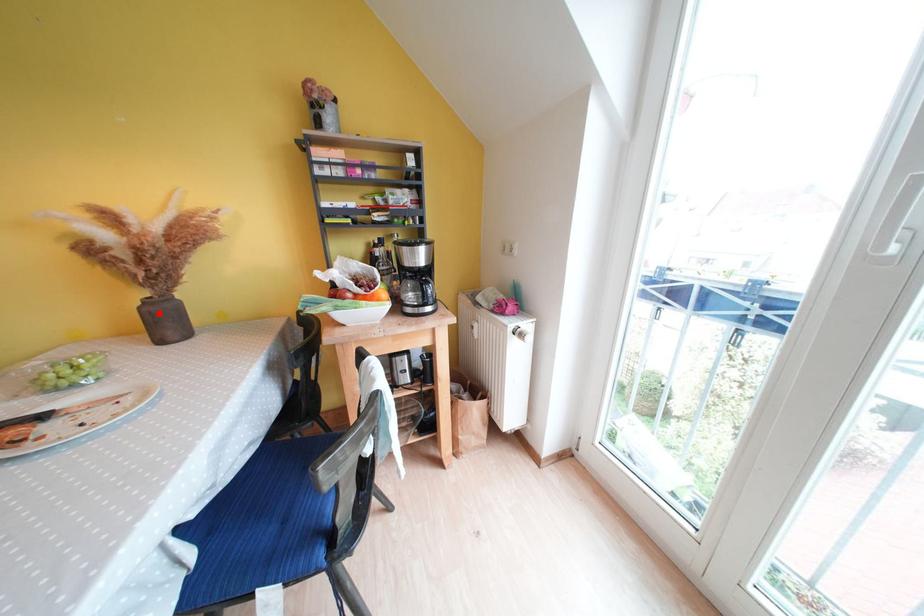
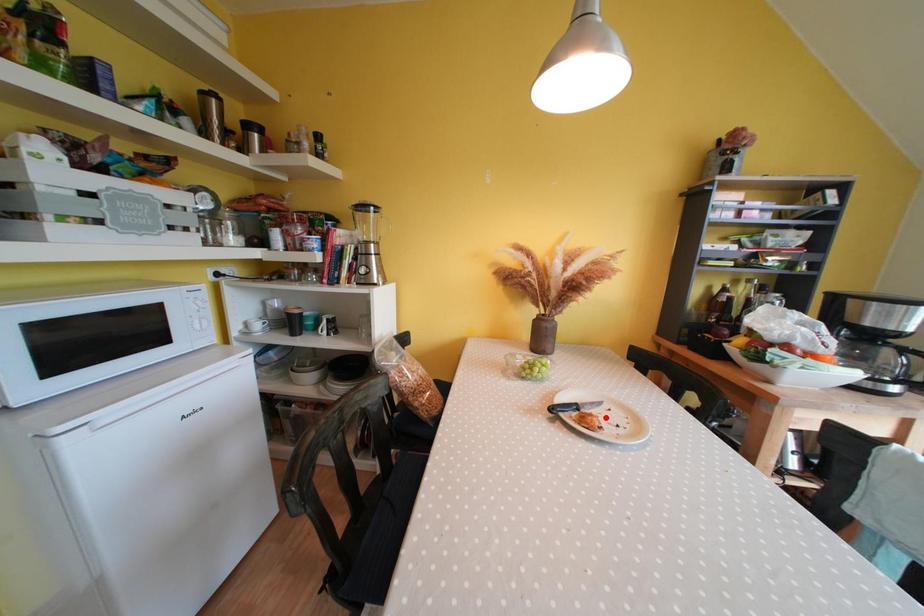
I am providing you with two images of the same scene from different viewpoints. A red point is marked on the first image and another point is marked on the second image. Do the highlighted points in image1 and image2 indicate the same real-world spot?

No